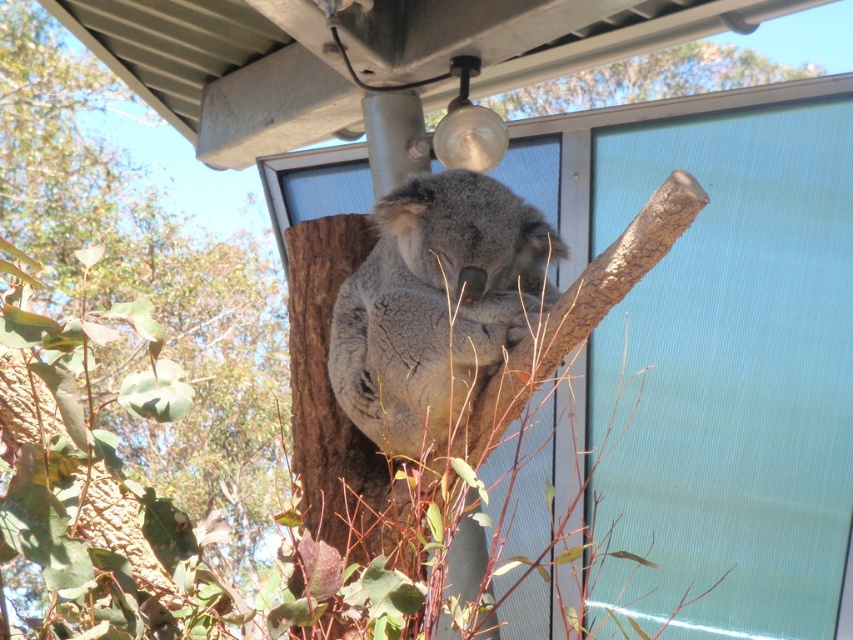
Is brown rough bark tree at center to the left of brown rough bark at upper center from the viewer's perspective?

Yes, brown rough bark tree at center is to the left of brown rough bark at upper center.

Does brown rough bark tree at center have a smaller size compared to brown rough bark at upper center?

Incorrect, brown rough bark tree at center is not smaller in size than brown rough bark at upper center.

You are a GUI agent. You are given a task and a screenshot of the screen. Output one action in this format:
    pyautogui.click(x=<x>, y=<y>)
    Task: Click on the brown rough bark tree at center
    This screenshot has height=640, width=853.
    Given the screenshot: What is the action you would take?
    pyautogui.click(x=146, y=284)

Is point (111, 348) positioned behind point (473, 266)?

Yes, point (111, 348) is farther from viewer.

Does brown rough bark tree at center have a smaller size compared to gray furry koala at center?

Incorrect, brown rough bark tree at center is not smaller in size than gray furry koala at center.

Locate an element on the screen. brown rough bark tree at center is located at coordinates (146, 284).

The width and height of the screenshot is (853, 640). I want to click on brown rough bark tree at center, so click(x=146, y=284).

Does gray furry koala at center have a lesser height compared to brown rough bark at upper center?

No.

Consider the image. Does gray furry koala at center appear under brown rough bark at upper center?

Yes.

Does point (413, 256) lie in front of point (697, 51)?

Yes, it is in front of point (697, 51).

Identify the location of gray furry koala at center. Image resolution: width=853 pixels, height=640 pixels. (436, 305).